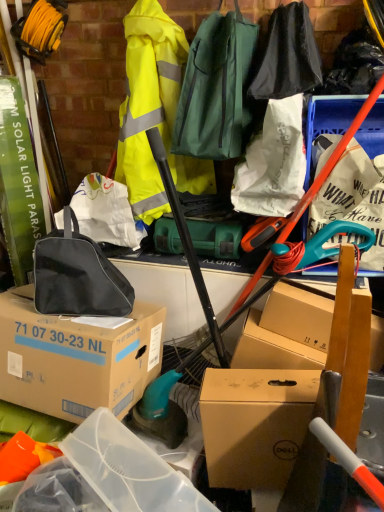
Question: Is black fabric bag at center-left, arranged as the 1th luggage and bags when viewed from the left, to the right of high-visibility yellow jacket at upper center, arranged as the third clothing when viewed from the right, from the viewer's perspective?

Choices:
 (A) yes
 (B) no

Answer: (B)

Question: Does black fabric bag at center-left, arranged as the 2th luggage and bags when viewed from the top, lie in front of high-visibility yellow jacket at upper center, arranged as the third clothing when viewed from the right?

Choices:
 (A) yes
 (B) no

Answer: (A)

Question: From a real-world perspective, is black fabric bag at center-left, which ranks as the second luggage and bags in right-to-left order, below high-visibility yellow jacket at upper center, marked as the first clothing in a left-to-right arrangement?

Choices:
 (A) yes
 (B) no

Answer: (A)

Question: Is black fabric bag at center-left, which is counted as the 1th luggage and bags, starting from the bottom, smaller than high-visibility yellow jacket at upper center, marked as the first clothing in a left-to-right arrangement?

Choices:
 (A) no
 (B) yes

Answer: (B)

Question: Does black fabric bag at center-left, arranged as the 2th luggage and bags when viewed from the top, turn towards high-visibility yellow jacket at upper center, arranged as the third clothing when viewed from the right?

Choices:
 (A) yes
 (B) no

Answer: (B)

Question: Is black fabric bag at center-left, which is counted as the 1th luggage and bags, starting from the bottom, behind high-visibility yellow jacket at upper center, marked as the first clothing in a left-to-right arrangement?

Choices:
 (A) yes
 (B) no

Answer: (B)

Question: Is brown cardboard box at center, which ranks as the first box in left-to-right order, directly adjacent to white paper bag at upper right?

Choices:
 (A) yes
 (B) no

Answer: (B)

Question: Is white paper bag at upper right inside brown cardboard box at center, which ranks as the first box in left-to-right order?

Choices:
 (A) yes
 (B) no

Answer: (B)

Question: Does brown cardboard box at center, which ranks as the first box in left-to-right order, lie behind white paper bag at upper right?

Choices:
 (A) yes
 (B) no

Answer: (B)

Question: Is brown cardboard box at center, arranged as the second box when viewed from the right, located outside white paper bag at upper right?

Choices:
 (A) no
 (B) yes

Answer: (B)

Question: From the image's perspective, does brown cardboard box at center, arranged as the second box when viewed from the right, appear lower than white paper bag at upper right?

Choices:
 (A) no
 (B) yes

Answer: (B)

Question: Does brown cardboard box at center, arranged as the second box when viewed from the right, appear on the right side of white paper bag at upper right?

Choices:
 (A) no
 (B) yes

Answer: (A)

Question: From the image's perspective, is brown cardboard box at center, arranged as the second box when viewed from the right, located above black fabric bag at upper center, placed as the 3th clothing when sorted from left to right?

Choices:
 (A) yes
 (B) no

Answer: (B)